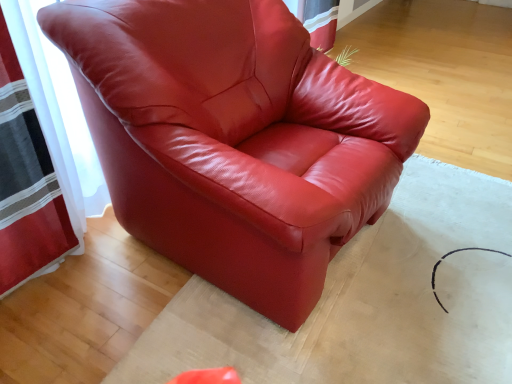
Find the location of a particular element. The width and height of the screenshot is (512, 384). spots to the right of matte red leather armchair at center is located at coordinates (445, 230).